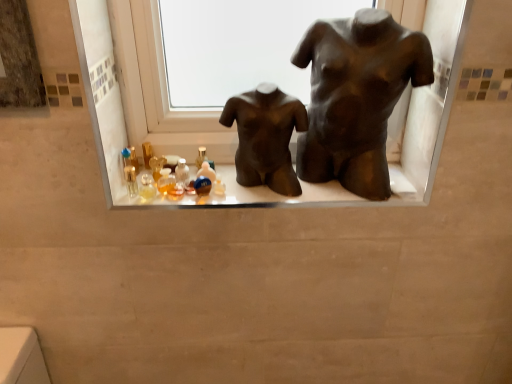
Find the location of a particular element. This screenshot has height=384, width=512. matte black mannequins at center is located at coordinates (240, 194).

I want to click on bronze/statue at center, acting as the 2th statue (sculpture) starting from the left, so click(356, 97).

What do you see at coordinates (265, 137) in the screenshot? I see `bronze statue at center, the second statue (sculpture) from the right` at bounding box center [265, 137].

What are the coordinates of `matte black mannequins at center` in the screenshot? It's located at (240, 194).

Between point (308, 51) and point (233, 121), which one is positioned in front?

The point (233, 121) is closer to the camera.

Does bronze/statue at center, acting as the 2th statue (sculpture) starting from the left, come behind bronze statue at center, the second statue (sculpture) from the right?

No, bronze/statue at center, acting as the 2th statue (sculpture) starting from the left, is in front of bronze statue at center, the second statue (sculpture) from the right.

Where is `statue (sculpture) on the right of bronze statue at center, acting as the 1th statue (sculpture) starting from the left`? The image size is (512, 384). statue (sculpture) on the right of bronze statue at center, acting as the 1th statue (sculpture) starting from the left is located at coordinates (356, 97).

From the picture: Who is taller, bronze/statue at center, marked as the first statue (sculpture) in a right-to-left arrangement, or bronze statue at center, acting as the 1th statue (sculpture) starting from the left?

bronze/statue at center, marked as the first statue (sculpture) in a right-to-left arrangement.

Based on the photo, would you say bronze statue at center, the second statue (sculpture) from the right, is part of matte black mannequins at center's contents?

No.

Based on the photo, from a real-world perspective, is matte black mannequins at center above or below bronze statue at center, acting as the 1th statue (sculpture) starting from the left?

Clearly, from a real-world perspective, matte black mannequins at center is below bronze statue at center, acting as the 1th statue (sculpture) starting from the left.

From the image's perspective, which statue (sculpture) is the 1st one above the matte black mannequins at center? Please provide its 2D coordinates.

[(265, 137)]

Which object is wider, matte black mannequins at center or bronze statue at center, the second statue (sculpture) from the right?

→ With larger width is matte black mannequins at center.

How distant is bronze/statue at center, marked as the first statue (sculpture) in a right-to-left arrangement, from matte black mannequins at center?

13.18 centimeters.

From the image's perspective, is bronze/statue at center, marked as the first statue (sculpture) in a right-to-left arrangement, beneath matte black mannequins at center?

No, from the image's perspective, bronze/statue at center, marked as the first statue (sculpture) in a right-to-left arrangement, is not below matte black mannequins at center.

Can you confirm if bronze/statue at center, marked as the first statue (sculpture) in a right-to-left arrangement, is bigger than matte black mannequins at center?

Correct, bronze/statue at center, marked as the first statue (sculpture) in a right-to-left arrangement, is larger in size than matte black mannequins at center.

Can you confirm if bronze/statue at center, acting as the 2th statue (sculpture) starting from the left, is shorter than matte black mannequins at center?

No.

Is bronze statue at center, acting as the 1th statue (sculpture) starting from the left, aimed at matte black mannequins at center?

No, bronze statue at center, acting as the 1th statue (sculpture) starting from the left, does not turn towards matte black mannequins at center.

Is matte black mannequins at center surrounded by bronze statue at center, the second statue (sculpture) from the right?

Definitely not — matte black mannequins at center is not inside bronze statue at center, the second statue (sculpture) from the right.

Looking at this image, considering the positions of objects bronze statue at center, acting as the 1th statue (sculpture) starting from the left, and matte black mannequins at center in the image provided, who is behind, bronze statue at center, acting as the 1th statue (sculpture) starting from the left, or matte black mannequins at center?

Positioned behind is matte black mannequins at center.

Is bronze statue at center, the second statue (sculpture) from the right, next to matte black mannequins at center and touching it?

Yes, bronze statue at center, the second statue (sculpture) from the right, is touching matte black mannequins at center.

Would you consider matte black mannequins at center to be distant from bronze/statue at center, acting as the 2th statue (sculpture) starting from the left?

No, matte black mannequins at center is in close proximity to bronze/statue at center, acting as the 2th statue (sculpture) starting from the left.

Locate an element on the screen. the 2nd statue (sculpture) in front of the matte black mannequins at center is located at coordinates (356, 97).

Which of these two, matte black mannequins at center or bronze/statue at center, marked as the first statue (sculpture) in a right-to-left arrangement, is smaller?

matte black mannequins at center is smaller.

From a real-world perspective, which object stands above the other?

bronze/statue at center, marked as the first statue (sculpture) in a right-to-left arrangement, is physically above.

Where is `statue (sculpture) that appears below the bronze/statue at center, marked as the first statue (sculpture) in a right-to-left arrangement (from a real-world perspective)`? statue (sculpture) that appears below the bronze/statue at center, marked as the first statue (sculpture) in a right-to-left arrangement (from a real-world perspective) is located at coordinates (265, 137).

Is bronze statue at center, the second statue (sculpture) from the right, not within bronze/statue at center, marked as the first statue (sculpture) in a right-to-left arrangement?

Absolutely, bronze statue at center, the second statue (sculpture) from the right, is external to bronze/statue at center, marked as the first statue (sculpture) in a right-to-left arrangement.

Is bronze/statue at center, marked as the first statue (sculpture) in a right-to-left arrangement, at the back of bronze statue at center, the second statue (sculpture) from the right?

bronze statue at center, the second statue (sculpture) from the right, does not have its back to bronze/statue at center, marked as the first statue (sculpture) in a right-to-left arrangement.

From the image's perspective, does bronze statue at center, acting as the 1th statue (sculpture) starting from the left, appear higher than bronze/statue at center, marked as the first statue (sculpture) in a right-to-left arrangement?

No.

The image size is (512, 384). I want to click on statue (sculpture) behind the bronze/statue at center, acting as the 2th statue (sculpture) starting from the left, so click(x=265, y=137).

There is a matte black mannequins at center. Identify the location of the 1st statue (sculpture) above it (from a real-world perspective). The image size is (512, 384). (265, 137).

From the image, which object appears to be nearer to matte black mannequins at center, bronze statue at center, acting as the 1th statue (sculpture) starting from the left, or bronze/statue at center, acting as the 2th statue (sculpture) starting from the left?

bronze statue at center, acting as the 1th statue (sculpture) starting from the left, lies closer to matte black mannequins at center than the other object.

When comparing their distances from matte black mannequins at center, does bronze/statue at center, marked as the first statue (sculpture) in a right-to-left arrangement, or bronze statue at center, the second statue (sculpture) from the right, seem closer?

bronze statue at center, the second statue (sculpture) from the right.

When comparing their distances from bronze/statue at center, marked as the first statue (sculpture) in a right-to-left arrangement, does matte black mannequins at center or bronze statue at center, acting as the 1th statue (sculpture) starting from the left, seem further?

matte black mannequins at center.

Considering their positions, is matte black mannequins at center positioned closer to bronze statue at center, the second statue (sculpture) from the right, than bronze/statue at center, acting as the 2th statue (sculpture) starting from the left?

bronze/statue at center, acting as the 2th statue (sculpture) starting from the left.

When comparing their distances from bronze statue at center, acting as the 1th statue (sculpture) starting from the left, does bronze/statue at center, acting as the 2th statue (sculpture) starting from the left, or matte black mannequins at center seem closer?

The object closer to bronze statue at center, acting as the 1th statue (sculpture) starting from the left, is bronze/statue at center, acting as the 2th statue (sculpture) starting from the left.

When comparing their distances from bronze/statue at center, acting as the 2th statue (sculpture) starting from the left, does bronze statue at center, acting as the 1th statue (sculpture) starting from the left, or matte black mannequins at center seem closer?

bronze statue at center, acting as the 1th statue (sculpture) starting from the left, lies closer to bronze/statue at center, acting as the 2th statue (sculpture) starting from the left, than the other object.

At what (x,y) coordinates should I click in order to perform the action: click on window sill situated between bronze statue at center, acting as the 1th statue (sculpture) starting from the left, and bronze/statue at center, acting as the 2th statue (sculpture) starting from the left, from left to right. Please return your answer as a coordinate pair (x, y). Looking at the image, I should click on click(240, 194).